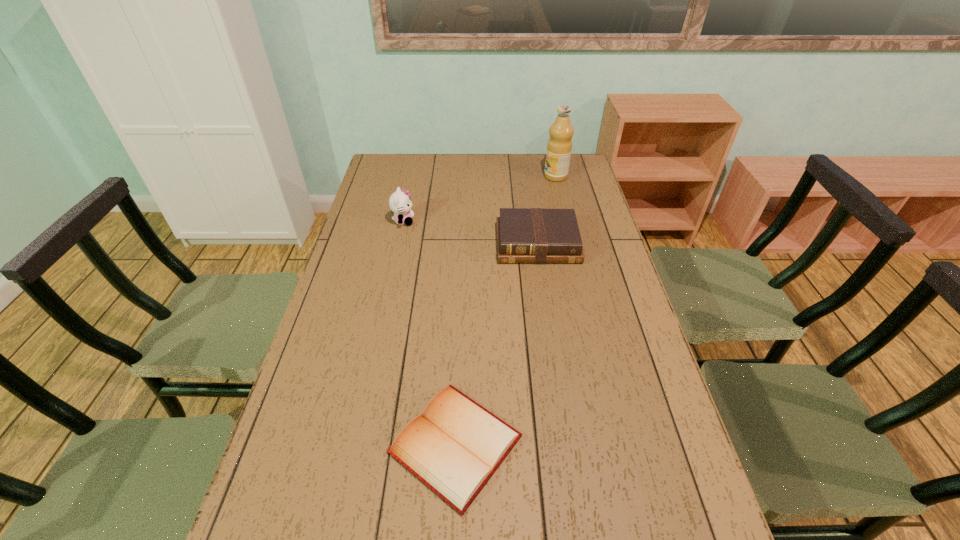
At what (x,y) coordinates should I click in order to perform the action: click on vacant point located 0.130m on the label of the olive oil. Please return your answer as a coordinate pair (x, y). This screenshot has height=540, width=960. Looking at the image, I should click on (513, 177).

Identify the location of vacant space situated 0.070m on the front-facing side of the kitten. (434, 221).

Locate an element on the screen. This screenshot has height=540, width=960. vacant space located 0.130m on the spine side of the third tallest object is located at coordinates coord(545,293).

Where is `free space located on the left of the nearest object`? This screenshot has height=540, width=960. free space located on the left of the nearest object is located at coordinates (309, 444).

This screenshot has height=540, width=960. I want to click on object at the far edge, so click(559, 146).

This screenshot has width=960, height=540. I want to click on object that is at the left edge, so click(x=400, y=203).

You are a GUI agent. You are given a task and a screenshot of the screen. Output one action in this format:
    pyautogui.click(x=<x>, y=<y>)
    Task: Click on the olive oil located at the right edge
    This screenshot has height=540, width=960.
    Given the screenshot: What is the action you would take?
    pyautogui.click(x=559, y=146)

The width and height of the screenshot is (960, 540). I want to click on Bible at the right edge, so click(x=524, y=235).

I want to click on object at the far right corner, so click(x=559, y=146).

Where is `free space at the far edge`? This screenshot has height=540, width=960. free space at the far edge is located at coordinates (541, 172).